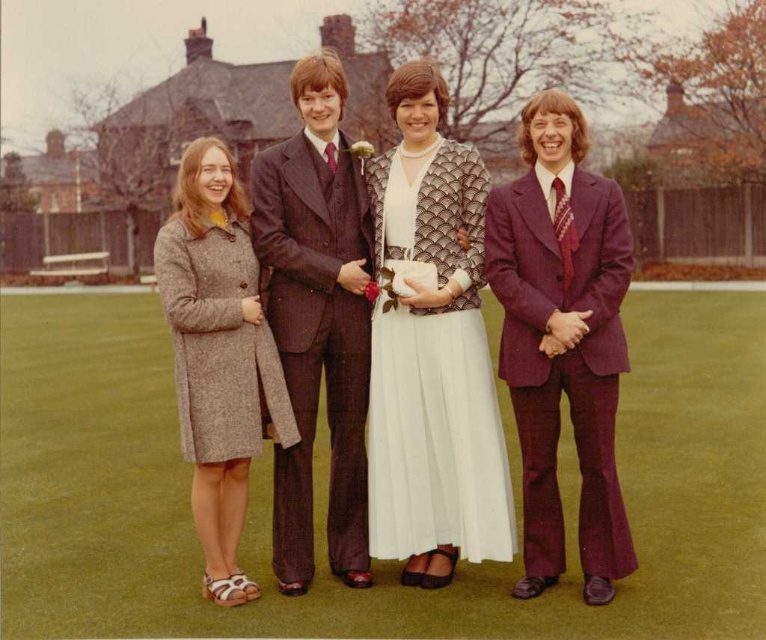
You are organizing a charity event and need to determine which of the two garments can accommodate more attendees in a limited space. Based on the image, which garment between the brown pinstripe suit at center and the gray wool coat at left takes up more space?

The brown pinstripe suit at center takes up more space because it is larger in size than the gray wool coat at left.